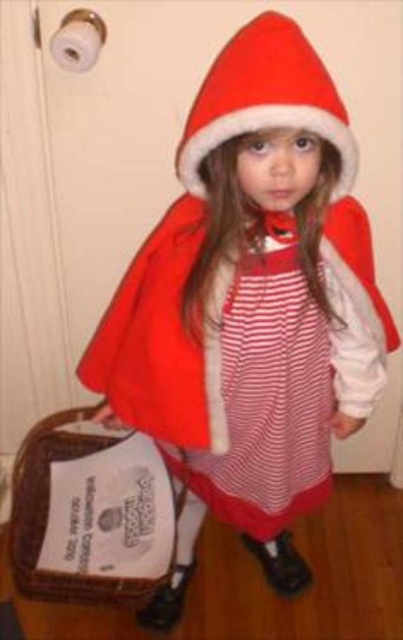
Question: Can you confirm if red striped dress at center is wider than red velvet santa hat at center?

Choices:
 (A) yes
 (B) no

Answer: (A)

Question: Can you confirm if red striped dress at center is thinner than red velvet santa hat at center?

Choices:
 (A) no
 (B) yes

Answer: (A)

Question: Where is red striped dress at center located in relation to red velvet santa hat at center in the image?

Choices:
 (A) left
 (B) right

Answer: (A)